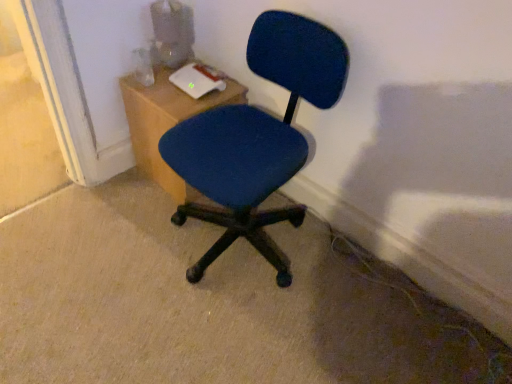
Question: Considering the relative sizes of wooden table at upper left and blue fabric chair at center in the image provided, is wooden table at upper left shorter than blue fabric chair at center?

Choices:
 (A) yes
 (B) no

Answer: (A)

Question: From the image's perspective, is wooden table at upper left under blue fabric chair at center?

Choices:
 (A) no
 (B) yes

Answer: (A)

Question: Is blue fabric chair at center located within wooden table at upper left?

Choices:
 (A) no
 (B) yes

Answer: (A)

Question: From a real-world perspective, is wooden table at upper left below blue fabric chair at center?

Choices:
 (A) no
 (B) yes

Answer: (B)

Question: Considering the relative sizes of wooden table at upper left and blue fabric chair at center in the image provided, is wooden table at upper left thinner than blue fabric chair at center?

Choices:
 (A) no
 (B) yes

Answer: (B)

Question: Considering the relative sizes of wooden table at upper left and blue fabric chair at center in the image provided, is wooden table at upper left wider than blue fabric chair at center?

Choices:
 (A) no
 (B) yes

Answer: (A)

Question: Considering the relative sizes of blue fabric chair at center and wooden table at upper left in the image provided, is blue fabric chair at center shorter than wooden table at upper left?

Choices:
 (A) yes
 (B) no

Answer: (B)

Question: Could wooden table at upper left be considered to be inside blue fabric chair at center?

Choices:
 (A) no
 (B) yes

Answer: (A)

Question: Is blue fabric chair at center positioned with its back to wooden table at upper left?

Choices:
 (A) no
 (B) yes

Answer: (A)

Question: Can you confirm if blue fabric chair at center is taller than wooden table at upper left?

Choices:
 (A) yes
 (B) no

Answer: (A)

Question: Considering the relative sizes of blue fabric chair at center and wooden table at upper left in the image provided, is blue fabric chair at center smaller than wooden table at upper left?

Choices:
 (A) yes
 (B) no

Answer: (B)

Question: Is blue fabric chair at center next to wooden table at upper left?

Choices:
 (A) yes
 (B) no

Answer: (B)

Question: From the image's perspective, is blue fabric chair at center positioned above or below wooden table at upper left?

Choices:
 (A) above
 (B) below

Answer: (B)